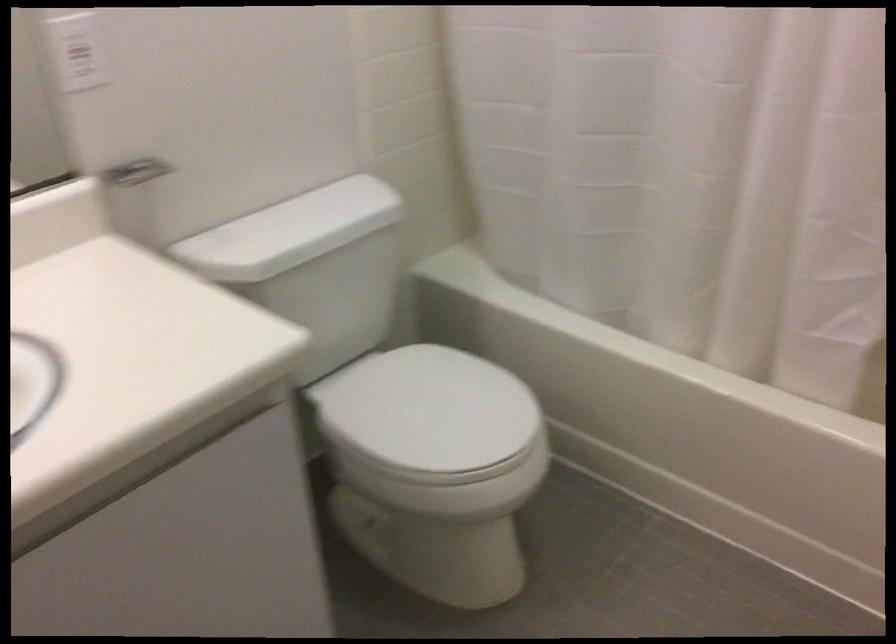
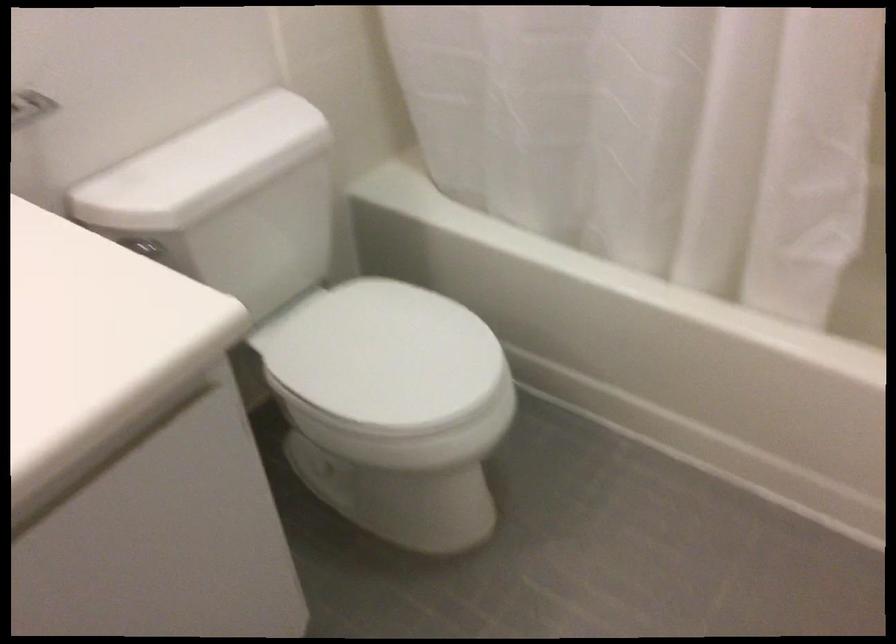
Question: Based on the continuous images, in which direction is the camera rotating? Reply with the corresponding letter.

Choices:
 (A) Left
 (B) Right
 (C) Up
 (D) Down

Answer: (D)